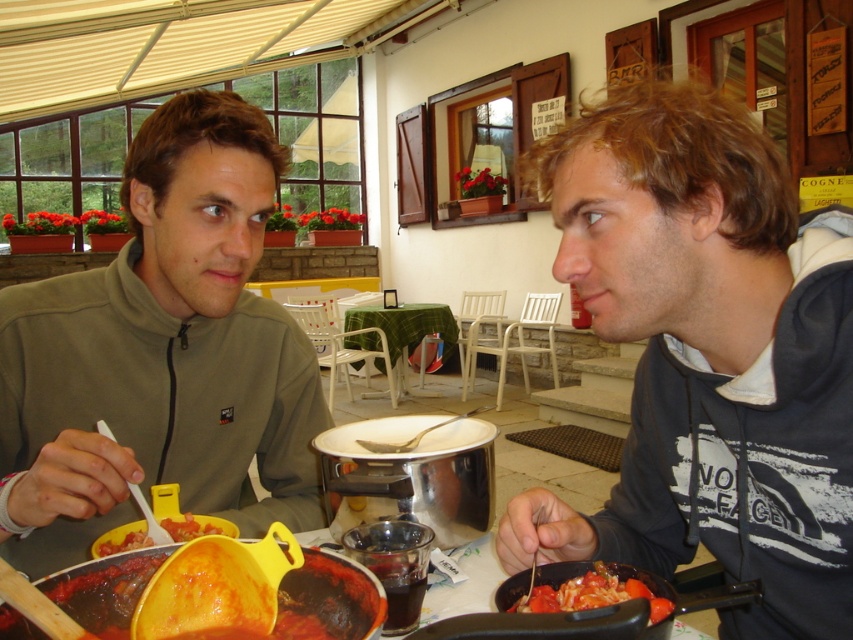
Which is behind, point (550, 577) or point (440, 332)?

The point (440, 332) is more distant.

Between point (648, 580) and point (383, 324), which one is positioned behind?

The point (383, 324) is more distant.

This screenshot has width=853, height=640. I want to click on tomato sauce pasta at lower center, so click(583, 588).

From the picture: Is dark gray hoodie at right bigger than tomato sauce pasta at lower center?

Indeed, dark gray hoodie at right has a larger size compared to tomato sauce pasta at lower center.

Is dark gray hoodie at right wider than tomato sauce pasta at lower center?

Yes.

Does point (804, 595) come farther from viewer compared to point (537, 584)?

That is True.

At what (x,y) coordinates should I click in order to perform the action: click on dark gray hoodie at right. Please return your answer as a coordinate pair (x, y). The image size is (853, 640). Looking at the image, I should click on (706, 355).

Can you confirm if matte green jacket at left is positioned above tomato sauce pasta at lower center?

Yes.

Between matte green jacket at left and tomato sauce pasta at lower center, which one appears on the right side from the viewer's perspective?

tomato sauce pasta at lower center

Who is more forward, (152, 312) or (622, 593)?

Positioned in front is point (622, 593).

Find the location of a particular element. This screenshot has width=853, height=640. matte green jacket at left is located at coordinates (161, 353).